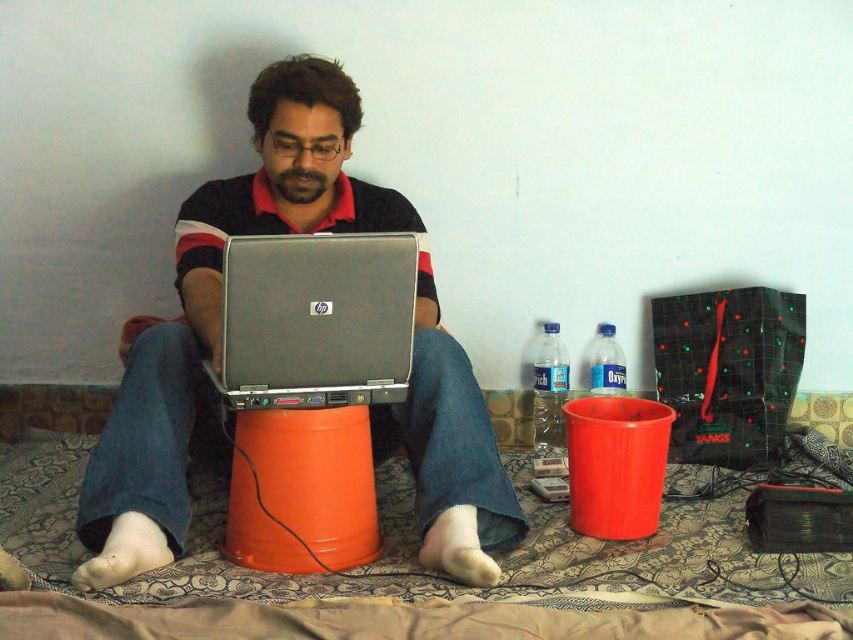
Can you confirm if matte black laptop at center is wider than silver metallic laptop at center?

Yes, matte black laptop at center is wider than silver metallic laptop at center.

Who is lower down, matte black laptop at center or silver metallic laptop at center?

silver metallic laptop at center

Measure the distance between matte black laptop at center and camera.

They are 1.62 meters apart.

Image resolution: width=853 pixels, height=640 pixels. I want to click on matte black laptop at center, so (x=219, y=308).

Which is behind, point (465, 472) or point (548, 432)?

Point (548, 432)

At what (x,y) coordinates should I click in order to perform the action: click on matte black laptop at center. Please return your answer as a coordinate pair (x, y). This screenshot has width=853, height=640. Looking at the image, I should click on (219, 308).

I want to click on matte black laptop at center, so click(219, 308).

The image size is (853, 640). What are the coordinates of `matte black laptop at center` in the screenshot? It's located at (219, 308).

Does silver metallic laptop at center appear on the right side of transparent plastic bottle at right?

No, silver metallic laptop at center is not to the right of transparent plastic bottle at right.

At what (x,y) coordinates should I click in order to perform the action: click on silver metallic laptop at center. Please return your answer as a coordinate pair (x, y). Looking at the image, I should click on 316,320.